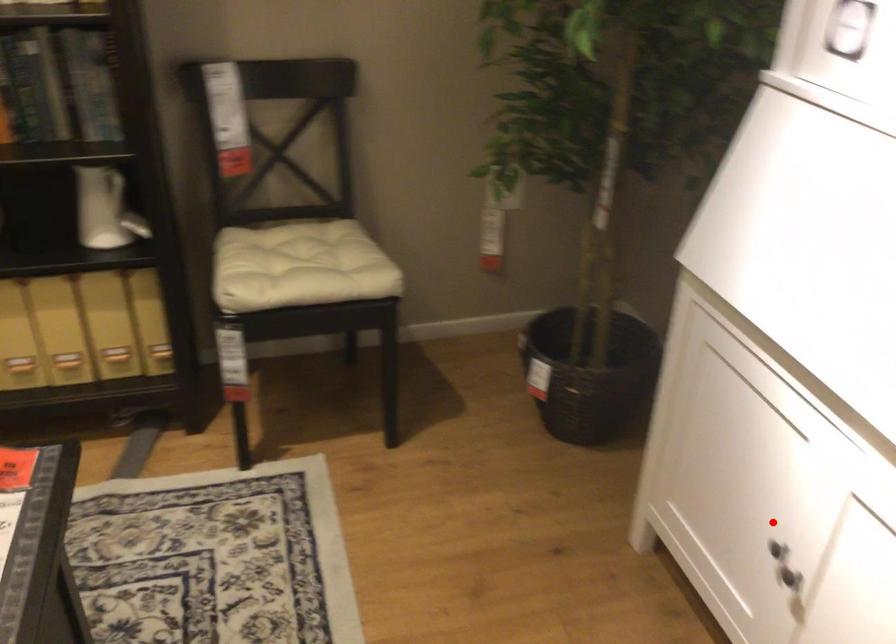
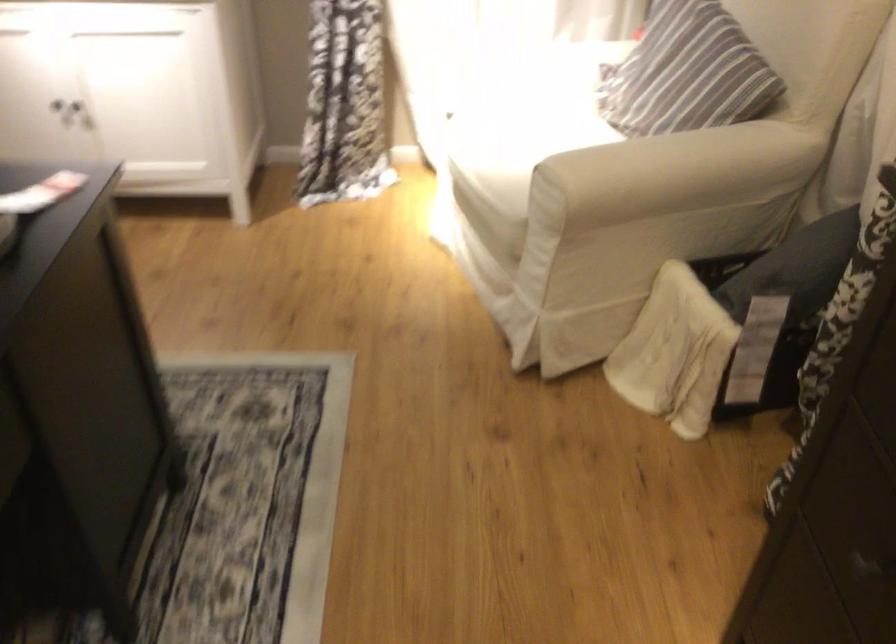
Find the pixel in the second image that matches the highlighted location in the first image.

(52, 99)